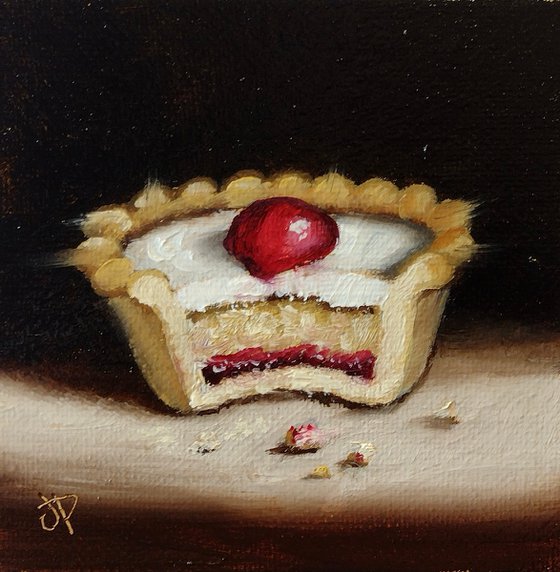
You are a GUI agent. You are given a task and a screenshot of the screen. Output one action in this format:
    pyautogui.click(x=<x>, y=<y>)
    Task: Click on the surface
    
    Given the screenshot: What is the action you would take?
    pyautogui.click(x=253, y=478)